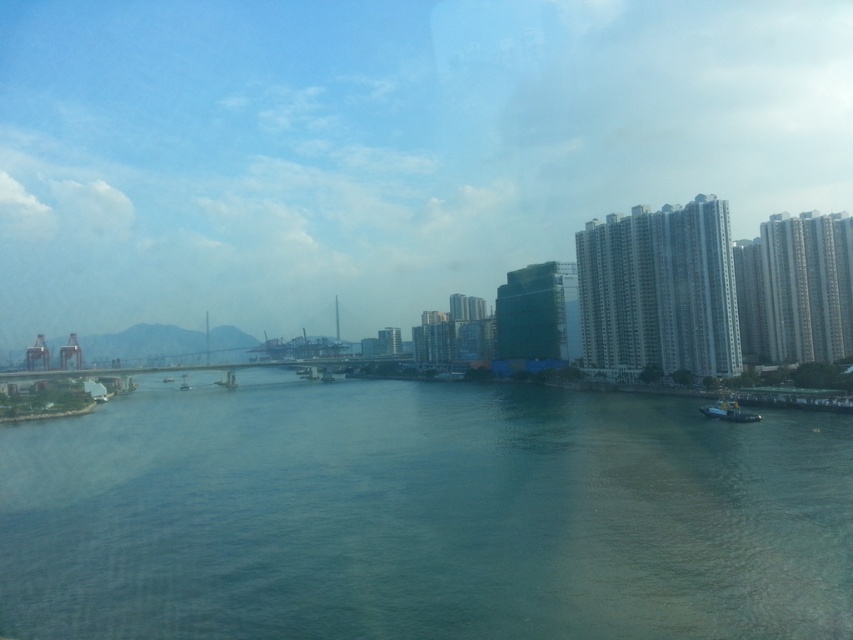
Question: Which object is positioned farthest from the yellow matte boat at lower right?

Choices:
 (A) greenish-blue water at center
 (B) metallic gray boat at center

Answer: (B)

Question: Is greenish-blue water at center positioned in front of metallic gray boat at center?

Choices:
 (A) yes
 (B) no

Answer: (A)

Question: Which object is positioned farthest from the yellow matte boat at lower right?

Choices:
 (A) metallic gray boat at center
 (B) greenish-blue water at center

Answer: (A)

Question: Considering the real-world distances, which object is farthest from the metallic gray boat at center?

Choices:
 (A) yellow matte boat at lower right
 (B) greenish-blue water at center

Answer: (A)

Question: Is greenish-blue water at center positioned behind yellow matte boat at lower right?

Choices:
 (A) no
 (B) yes

Answer: (A)

Question: Does greenish-blue water at center have a lesser width compared to metallic gray boat at center?

Choices:
 (A) no
 (B) yes

Answer: (A)